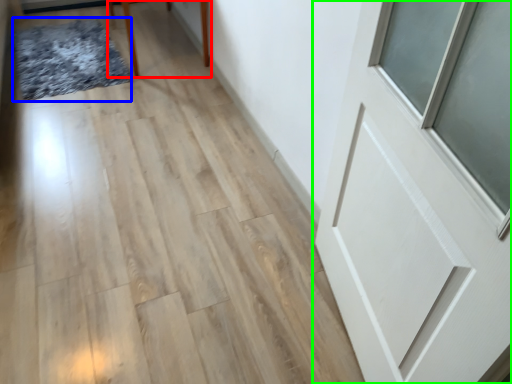
Question: Which object is the farthest from furniture (highlighted by a red box)? Choose among these: mat (highlighted by a blue box) or door (highlighted by a green box).

Choices:
 (A) mat
 (B) door

Answer: (B)